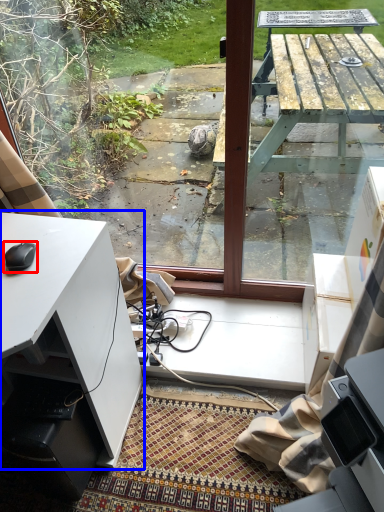
Question: Which point is further to the camera, mouse (highlighted by a red box) or desk (highlighted by a blue box)?

Choices:
 (A) mouse
 (B) desk

Answer: (A)